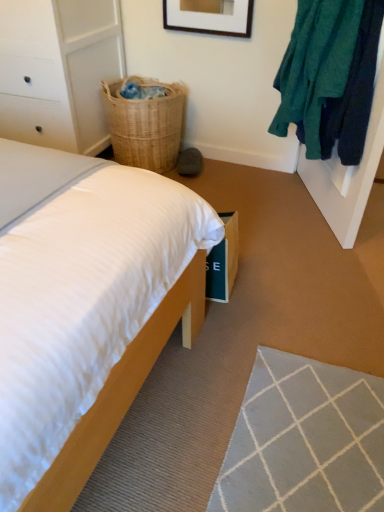
Where is `free spot above wooden bed at lower left (from a real-world perspective)`? free spot above wooden bed at lower left (from a real-world perspective) is located at coordinates (274, 311).